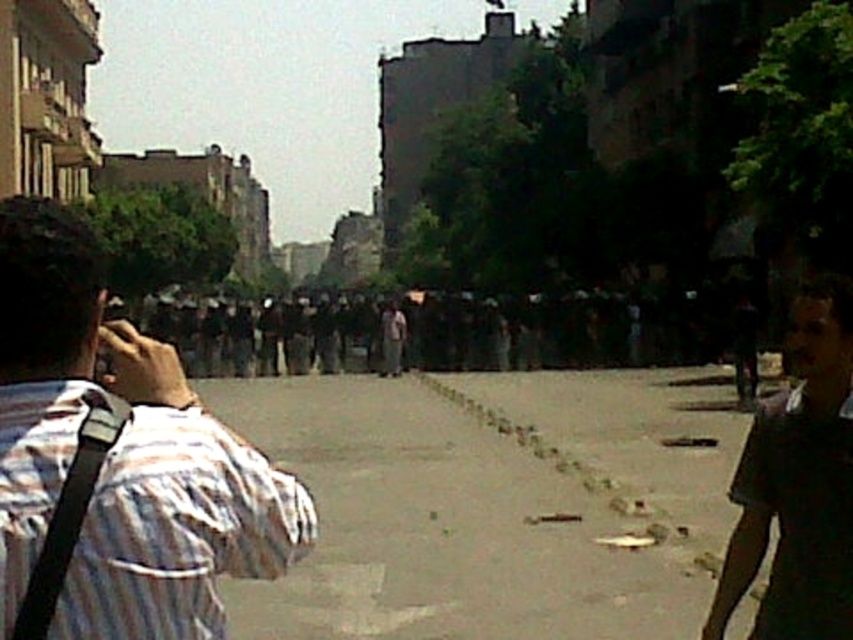
Question: Which of these objects is positioned closest to the striped cotton shirt at left?

Choices:
 (A) gray concrete pavement at center
 (B) dark brown shirt at lower right

Answer: (B)

Question: Does gray concrete pavement at center appear over striped cotton shirt at left?

Choices:
 (A) yes
 (B) no

Answer: (B)

Question: Can you confirm if striped cotton shirt at left is smaller than dark brown shirt at lower right?

Choices:
 (A) no
 (B) yes

Answer: (B)

Question: Is gray concrete pavement at center bigger than dark brown shirt at lower right?

Choices:
 (A) yes
 (B) no

Answer: (B)

Question: Which point is closer to the camera?

Choices:
 (A) (178, 609)
 (B) (490, 440)
 (C) (828, 291)

Answer: (A)

Question: Which point is closer to the camera?

Choices:
 (A) gray concrete pavement at center
 (B) striped cotton shirt at left
 (C) dark brown shirt at lower right

Answer: (B)